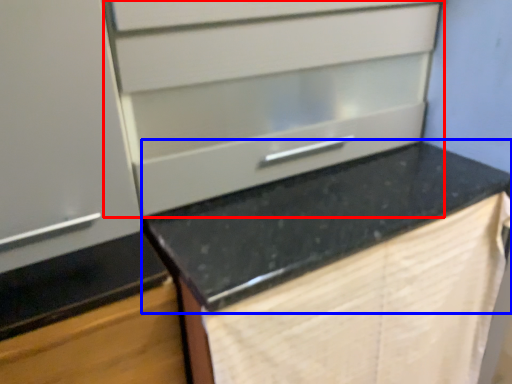
Question: Which of the following is the closest to the observer, drawer (highlighted by a red box) or countertop (highlighted by a blue box)?

Choices:
 (A) drawer
 (B) countertop

Answer: (B)